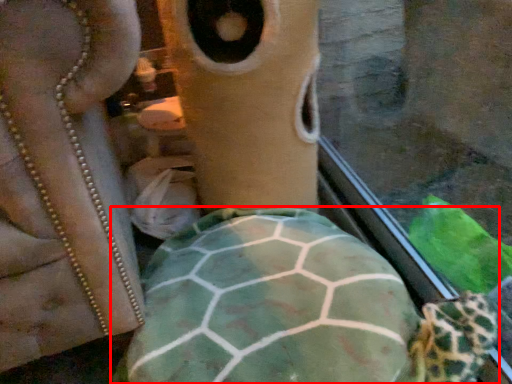
Question: From the image's perspective, considering the relative positions of tortoise (annotated by the red box) and face in the image provided, where is tortoise (annotated by the red box) located with respect to the staircase?

Choices:
 (A) below
 (B) above

Answer: (A)